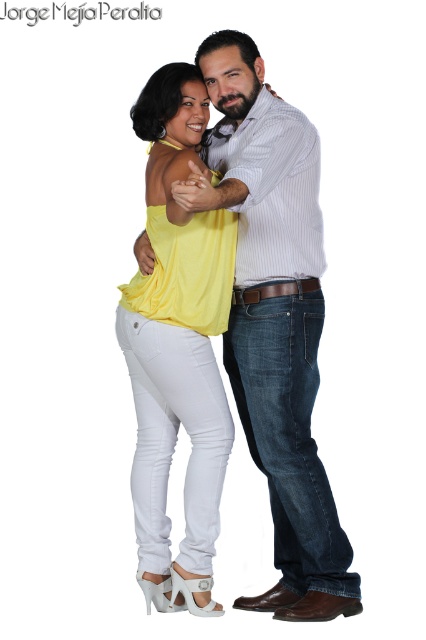
Does white matte jeans at center have a lesser width compared to matte yellow blouse at center?

No, white matte jeans at center is not thinner than matte yellow blouse at center.

Can you confirm if white matte jeans at center is positioned above matte yellow blouse at center?

Correct, white matte jeans at center is located above matte yellow blouse at center.

The height and width of the screenshot is (640, 426). What are the coordinates of `white matte jeans at center` in the screenshot? It's located at (276, 321).